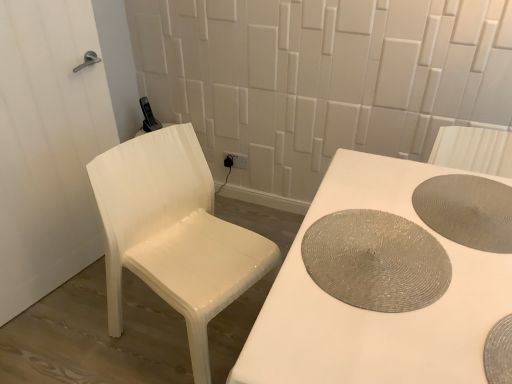
What do you see at coordinates (48, 147) in the screenshot? This screenshot has width=512, height=384. I see `white glossy door at left` at bounding box center [48, 147].

The height and width of the screenshot is (384, 512). What are the coordinates of `white glossy door at left` in the screenshot? It's located at (48, 147).

Locate an element on the screen. The height and width of the screenshot is (384, 512). matte gray placemat at right, the 1th manhole cover when ordered from back to front is located at coordinates (467, 211).

Is silver textured placemat at bottom right, acting as the first manhole cover starting from the front, oriented away from matte gray placemat at right, the 1th manhole cover when ordered from back to front?

That's right, silver textured placemat at bottom right, acting as the first manhole cover starting from the front, is facing away from matte gray placemat at right, the 1th manhole cover when ordered from back to front.

Considering the sizes of silver textured placemat at bottom right, acting as the first manhole cover starting from the front, and matte gray placemat at right, the 1th manhole cover when ordered from back to front, in the image, is silver textured placemat at bottom right, acting as the first manhole cover starting from the front, wider or thinner than matte gray placemat at right, the 1th manhole cover when ordered from back to front,?

Considering their sizes, silver textured placemat at bottom right, acting as the first manhole cover starting from the front, looks broader than matte gray placemat at right, the 1th manhole cover when ordered from back to front.

Considering the relative sizes of silver textured placemat at bottom right, acting as the first manhole cover starting from the front, and matte gray placemat at right, the 1th manhole cover when ordered from back to front, in the image provided, is silver textured placemat at bottom right, acting as the first manhole cover starting from the front, bigger than matte gray placemat at right, the 1th manhole cover when ordered from back to front,?

Yes, silver textured placemat at bottom right, acting as the first manhole cover starting from the front, is bigger than matte gray placemat at right, the 1th manhole cover when ordered from back to front.

In the scene shown: Between silver textured placemat at bottom right, acting as the first manhole cover starting from the front, and matte gray placemat at right, the 3th manhole cover from the front, which one appears on the right side from the viewer's perspective?

Positioned to the right is matte gray placemat at right, the 3th manhole cover from the front.

From the image's perspective, is white glossy chair at left above matte gray placemat at right, the 1th manhole cover when ordered from back to front?

No.

What's the angular difference between white glossy chair at left and matte gray placemat at right, the 1th manhole cover when ordered from back to front,'s facing directions?

The angular difference between white glossy chair at left and matte gray placemat at right, the 1th manhole cover when ordered from back to front, is 107 degrees.

Considering the points (120, 225) and (490, 183), which point is behind, point (120, 225) or point (490, 183)?

The point (120, 225) is farther.

Is white glossy chair at left facing away from matte gray placemat at right, the 3th manhole cover from the front?

No.

From a real-world perspective, is white glossy door at left on silver textured placemat at bottom right, acting as the first manhole cover starting from the front?

No, from a real-world perspective, white glossy door at left is not above silver textured placemat at bottom right, acting as the first manhole cover starting from the front.

Looking at this image, from the image's perspective, is white glossy door at left above or below silver textured placemat at bottom right, which is counted as the third manhole cover, starting from the back?

From the image's perspective, white glossy door at left appears above silver textured placemat at bottom right, which is counted as the third manhole cover, starting from the back.

Is white glossy door at left bigger than silver textured placemat at bottom right, which is counted as the third manhole cover, starting from the back?

Indeed, white glossy door at left has a larger size compared to silver textured placemat at bottom right, which is counted as the third manhole cover, starting from the back.

From the picture: Is white glossy door at left positioned beyond the bounds of silver textured placemat at bottom right, acting as the first manhole cover starting from the front?

Yes, white glossy door at left is outside of silver textured placemat at bottom right, acting as the first manhole cover starting from the front.

What's the angular difference between matte gray placemat at right, the 1th manhole cover when ordered from back to front, and white glossy door at left's facing directions?

106 degrees separate the facing orientations of matte gray placemat at right, the 1th manhole cover when ordered from back to front, and white glossy door at left.

Which is farther, [462,225] or [74,203]?

Positioned behind is point [74,203].

Is matte gray placemat at right, the 3th manhole cover from the front, shorter than white glossy door at left?

Yes, matte gray placemat at right, the 3th manhole cover from the front, is shorter than white glossy door at left.

From a real-world perspective, is shiny metallic placemat at table right, arranged as the second manhole cover when viewed from the back, located beneath white glossy chair at left?

No.

Which is closer to the camera, (x=410, y=273) or (x=222, y=259)?

Point (x=410, y=273) appears to be closer to the viewer than point (x=222, y=259).

Which object is thinner, shiny metallic placemat at table right, placed as the 2th manhole cover when sorted from front to back, or white glossy chair at left?

Thinner between the two is shiny metallic placemat at table right, placed as the 2th manhole cover when sorted from front to back.

Measure the distance between shiny metallic placemat at table right, placed as the 2th manhole cover when sorted from front to back, and white glossy chair at left.

shiny metallic placemat at table right, placed as the 2th manhole cover when sorted from front to back, is 22.65 inches from white glossy chair at left.

Consider the image. Is white glossy chair at left not near white glossy door at left?

That's not correct — white glossy chair at left is a little close to white glossy door at left.

Is white glossy chair at left looking in the opposite direction of white glossy door at left?

Yes.

Considering the sizes of white glossy chair at left and white glossy door at left in the image, is white glossy chair at left wider or thinner than white glossy door at left?

Considering their sizes, white glossy chair at left looks broader than white glossy door at left.

From a real-world perspective, relative to white glossy door at left, is white glossy chair at left vertically above or below?

In terms of real-world spatial position, white glossy chair at left is below white glossy door at left.

Who is taller, matte gray placemat at right, the 1th manhole cover when ordered from back to front, or silver textured placemat at bottom right, acting as the first manhole cover starting from the front?

With more height is silver textured placemat at bottom right, acting as the first manhole cover starting from the front.

In terms of width, does matte gray placemat at right, the 3th manhole cover from the front, look wider or thinner when compared to silver textured placemat at bottom right, acting as the first manhole cover starting from the front?

matte gray placemat at right, the 3th manhole cover from the front, is thinner than silver textured placemat at bottom right, acting as the first manhole cover starting from the front.

Is matte gray placemat at right, the 3th manhole cover from the front, behind silver textured placemat at bottom right, which is counted as the third manhole cover, starting from the back?

Yes, matte gray placemat at right, the 3th manhole cover from the front, is behind silver textured placemat at bottom right, which is counted as the third manhole cover, starting from the back.

Is point (425, 219) behind point (507, 381)?

Yes, it is.

Locate an element on the screen. This screenshot has width=512, height=384. manhole cover above the matte gray placemat at right, the 1th manhole cover when ordered from back to front (from a real-world perspective) is located at coordinates (499, 352).

The width and height of the screenshot is (512, 384). Identify the location of chair below the matte gray placemat at right, the 3th manhole cover from the front (from the image's perspective). (173, 233).

Estimate the real-world distances between objects in this image. Which object is further from matte gray placemat at right, the 3th manhole cover from the front, white glossy chair at left or white glossy door at left?

white glossy door at left.

Based on their spatial positions, is silver textured placemat at bottom right, acting as the first manhole cover starting from the front, or shiny metallic placemat at table right, arranged as the second manhole cover when viewed from the back, closer to white glossy door at left?

shiny metallic placemat at table right, arranged as the second manhole cover when viewed from the back, lies closer to white glossy door at left than the other object.

In the scene shown: Based on their spatial positions, is white glossy door at left or shiny metallic placemat at table right, placed as the 2th manhole cover when sorted from front to back, closer to white glossy chair at left?

white glossy door at left is closer to white glossy chair at left.

Estimate the real-world distances between objects in this image. Which object is closer to shiny metallic placemat at table right, placed as the 2th manhole cover when sorted from front to back, silver textured placemat at bottom right, which is counted as the third manhole cover, starting from the back, or white glossy door at left?

silver textured placemat at bottom right, which is counted as the third manhole cover, starting from the back, is positioned closer to the anchor shiny metallic placemat at table right, placed as the 2th manhole cover when sorted from front to back.

Which object lies nearer to the anchor point white glossy door at left, white glossy chair at left or silver textured placemat at bottom right, acting as the first manhole cover starting from the front?

Among the two, white glossy chair at left is located nearer to white glossy door at left.

When comparing their distances from shiny metallic placemat at table right, placed as the 2th manhole cover when sorted from front to back, does white glossy chair at left or matte gray placemat at right, the 1th manhole cover when ordered from back to front, seem closer?

matte gray placemat at right, the 1th manhole cover when ordered from back to front, lies closer to shiny metallic placemat at table right, placed as the 2th manhole cover when sorted from front to back, than the other object.

In the scene shown: When comparing their distances from silver textured placemat at bottom right, acting as the first manhole cover starting from the front, does white glossy door at left or white glossy chair at left seem further?

white glossy door at left is positioned further to the anchor silver textured placemat at bottom right, acting as the first manhole cover starting from the front.

Looking at the image, which one is located closer to white glossy chair at left, shiny metallic placemat at table right, placed as the 2th manhole cover when sorted from front to back, or silver textured placemat at bottom right, acting as the first manhole cover starting from the front?

shiny metallic placemat at table right, placed as the 2th manhole cover when sorted from front to back, is positioned closer to the anchor white glossy chair at left.

Find the location of a particular element. This screenshot has height=384, width=512. manhole cover positioned between silver textured placemat at bottom right, which is counted as the third manhole cover, starting from the back, and matte gray placemat at right, the 3th manhole cover from the front, from near to far is located at coordinates (376, 261).

You are a GUI agent. You are given a task and a screenshot of the screen. Output one action in this format:
    pyautogui.click(x=<x>, y=<y>)
    Task: Click on the chair located between white glossy door at left and matte gray placemat at right, the 3th manhole cover from the front, in the left-right direction
    
    Given the screenshot: What is the action you would take?
    pyautogui.click(x=173, y=233)

Identify the location of manhole cover located between white glossy chair at left and silver textured placemat at bottom right, which is counted as the third manhole cover, starting from the back, in the left-right direction. This screenshot has width=512, height=384. (376, 261).

Where is `chair between white glossy door at left and shiny metallic placemat at table right, placed as the 2th manhole cover when sorted from front to back, in the horizontal direction`? Image resolution: width=512 pixels, height=384 pixels. chair between white glossy door at left and shiny metallic placemat at table right, placed as the 2th manhole cover when sorted from front to back, in the horizontal direction is located at coordinates tap(173, 233).